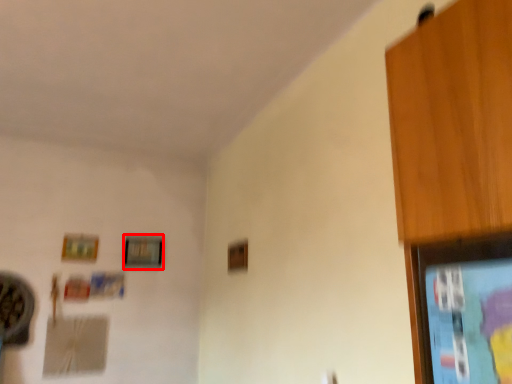
Question: From the image's perspective, what is the correct spatial positioning of picture frame (annotated by the red box) in reference to picture frame?

Choices:
 (A) below
 (B) above

Answer: (A)